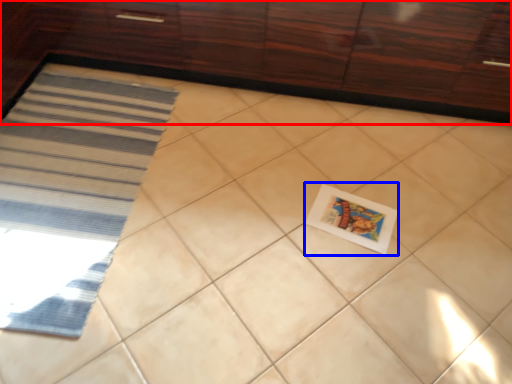
Question: Which of the following is the closest to the observer, cabinetry (highlighted by a red box) or postcard (highlighted by a blue box)?

Choices:
 (A) cabinetry
 (B) postcard

Answer: (A)